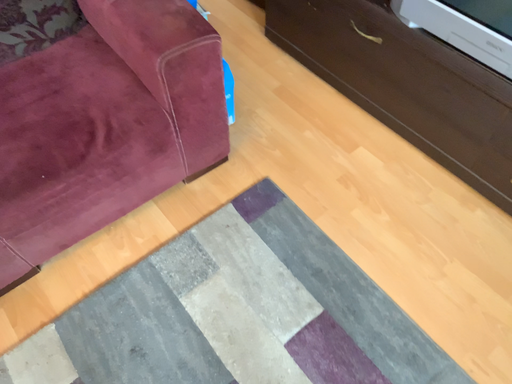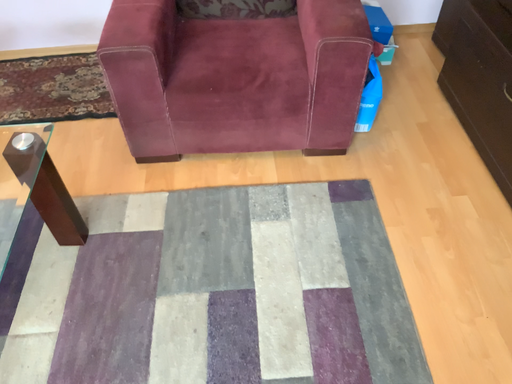
Question: How did the camera likely rotate when shooting the video?

Choices:
 (A) rotated left
 (B) rotated right

Answer: (A)